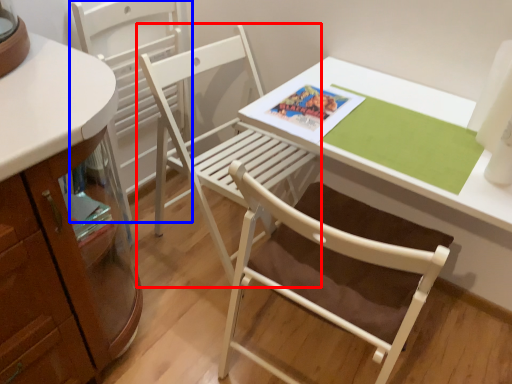
Question: Which point is closer to the camera, chair (highlighted by a red box) or chair (highlighted by a blue box)?

Choices:
 (A) chair
 (B) chair

Answer: (A)